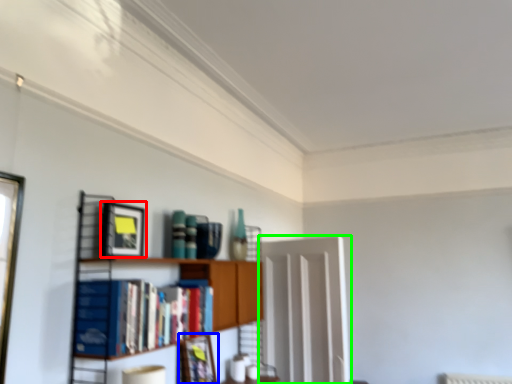
Question: Which is nearer to the picture frame (highlighted by a red box)? picture frame (highlighted by a blue box) or glass door (highlighted by a green box).

Choices:
 (A) picture frame
 (B) glass door

Answer: (A)